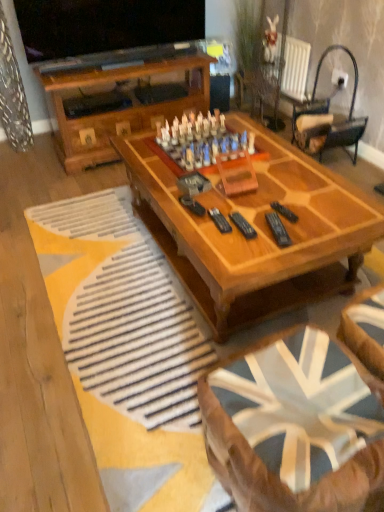
Find the location of a particular element. This screenshot has height=512, width=384. free space above wooden coffee table at center, which appears as the 2th coffee table when viewed from the front (from a real-world perspective) is located at coordinates (254, 180).